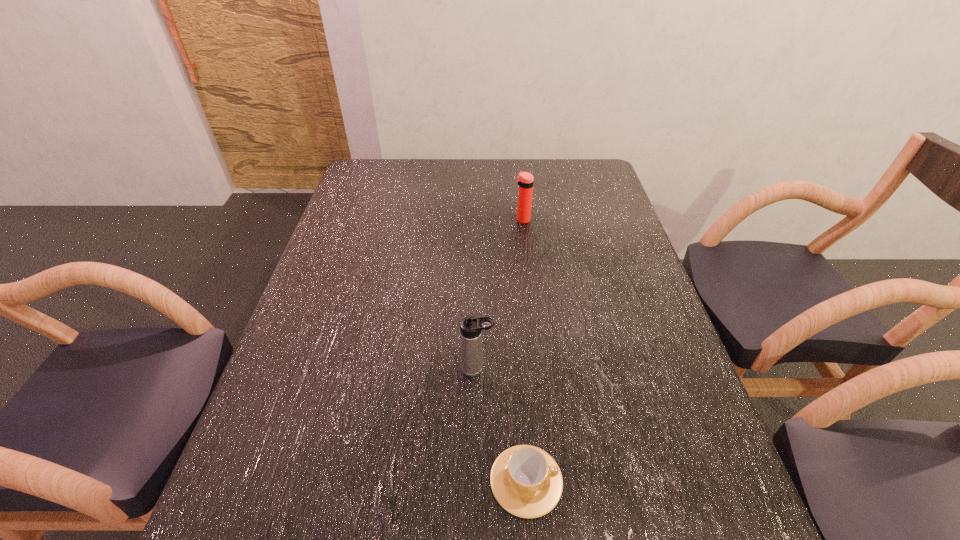
Find the location of `empty space that is in between the farther thermos bottle and the nearer thermos bottle`. empty space that is in between the farther thermos bottle and the nearer thermos bottle is located at coordinates (499, 294).

I want to click on blank region between the farther thermos bottle and the left thermos bottle, so (499, 294).

Identify the location of empty space between the right thermos bottle and the nearest object. (524, 350).

Image resolution: width=960 pixels, height=540 pixels. I want to click on vacant area that lies between the second farthest object and the farther thermos bottle, so click(x=499, y=294).

This screenshot has width=960, height=540. In order to click on object that stands as the closest to the farthest object in this screenshot , I will do `click(471, 327)`.

Locate which object ranks second in proximity to the second farthest object. Please provide its 2D coordinates. Your answer should be formatted as a tuple, i.e. [(x, y)], where the tuple contains the x and y coordinates of a point satisfying the conditions above.

[(525, 180)]

The image size is (960, 540). Identify the location of vacant space that satisfies the following two spatial constraints: 1. on the front side of the farthest object; 2. with the handle on the side of the cup. (553, 481).

At what (x,y) coordinates should I click in order to perform the action: click on free location that satisfies the following two spatial constraints: 1. on the front side of the right thermos bottle; 2. on the handle side of the nearer thermos bottle. Please return your answer as a coordinate pair (x, y). Looking at the image, I should click on (540, 369).